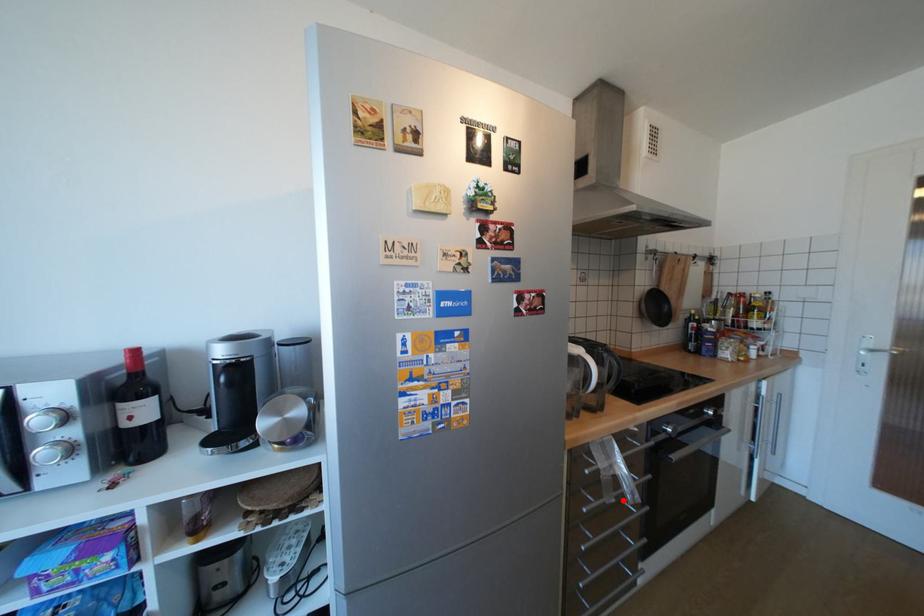
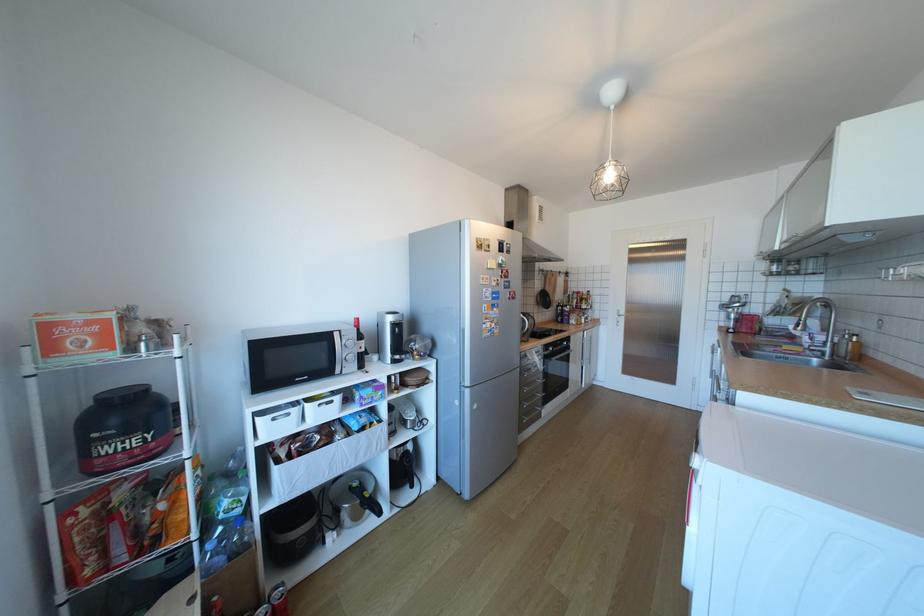
The point at the highlighted location is marked in the first image. Where is the corresponding point in the second image?

(543, 371)